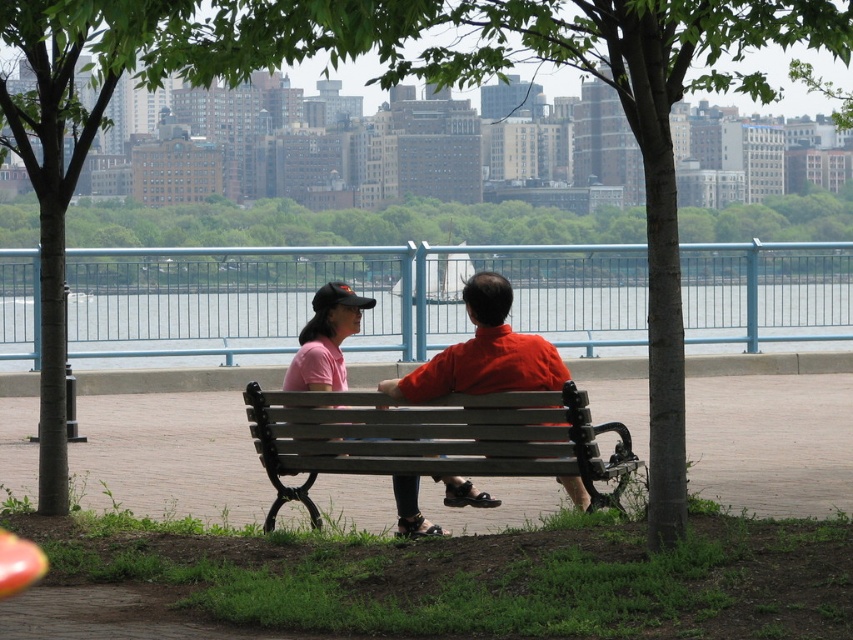
Question: Which is nearer to the blue water at center?

Choices:
 (A) matte pink shirt at center
 (B) wooden bench at center
 (C) matte orange shirt at center
 (D) green leafy tree at upper center

Answer: (A)

Question: Which object is positioned farthest from the blue water at center?

Choices:
 (A) wooden bench at center
 (B) green leafy tree at upper center
 (C) matte orange shirt at center

Answer: (B)

Question: Can you confirm if green leafy tree at upper center is positioned below matte orange shirt at center?

Choices:
 (A) yes
 (B) no

Answer: (B)

Question: Which of the following is the farthest from the observer?

Choices:
 (A) wooden bench at center
 (B) matte pink shirt at center

Answer: (B)

Question: Does matte orange shirt at center have a smaller size compared to matte pink shirt at center?

Choices:
 (A) yes
 (B) no

Answer: (B)

Question: Is green leafy tree at upper center in front of wooden bench at center?

Choices:
 (A) yes
 (B) no

Answer: (B)